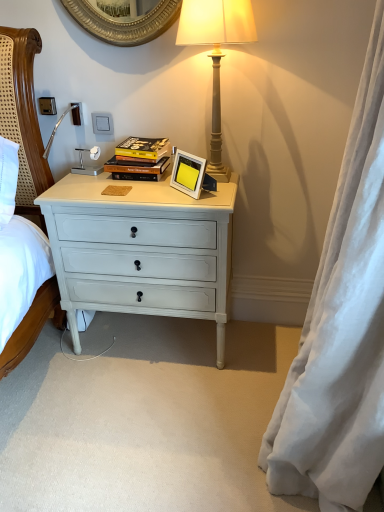
Identify the location of vacant space to the left of hardcover book at center. This screenshot has width=384, height=512. (89, 178).